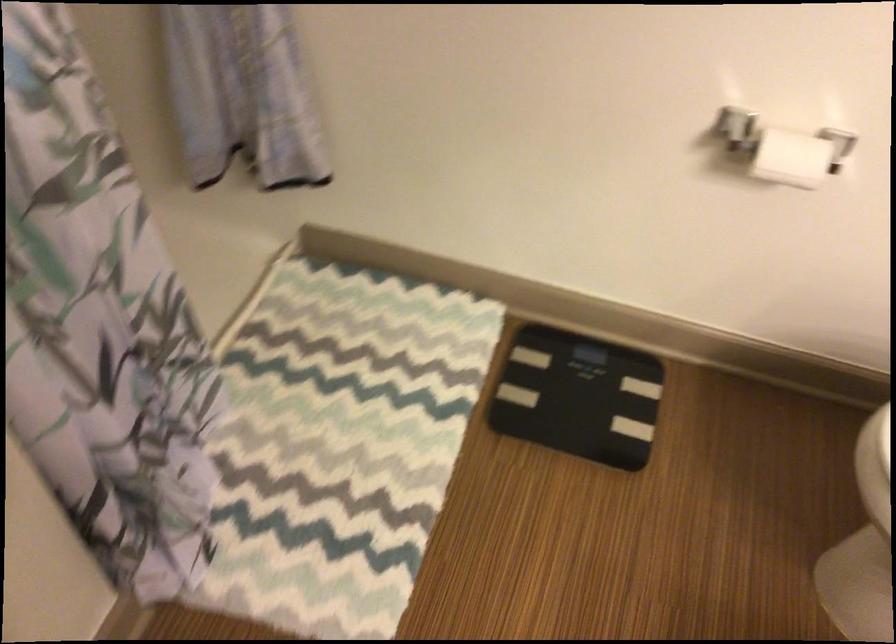
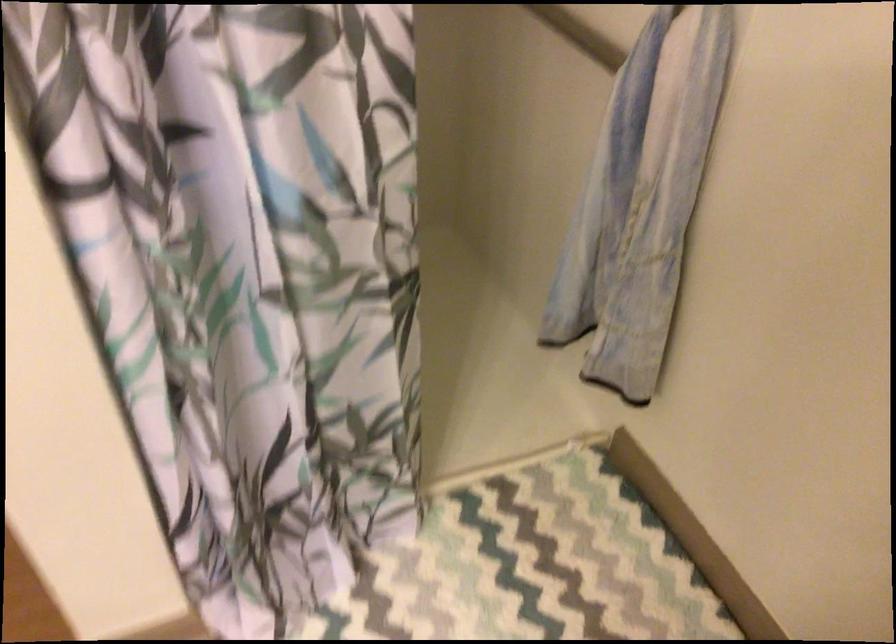
Question: The camera is either moving clockwise (left) or counter-clockwise (right) around the object. The first image is from the beginning of the video and the second image is from the end. Is the camera moving left or right when shooting the video?

Choices:
 (A) Left
 (B) Right

Answer: (B)